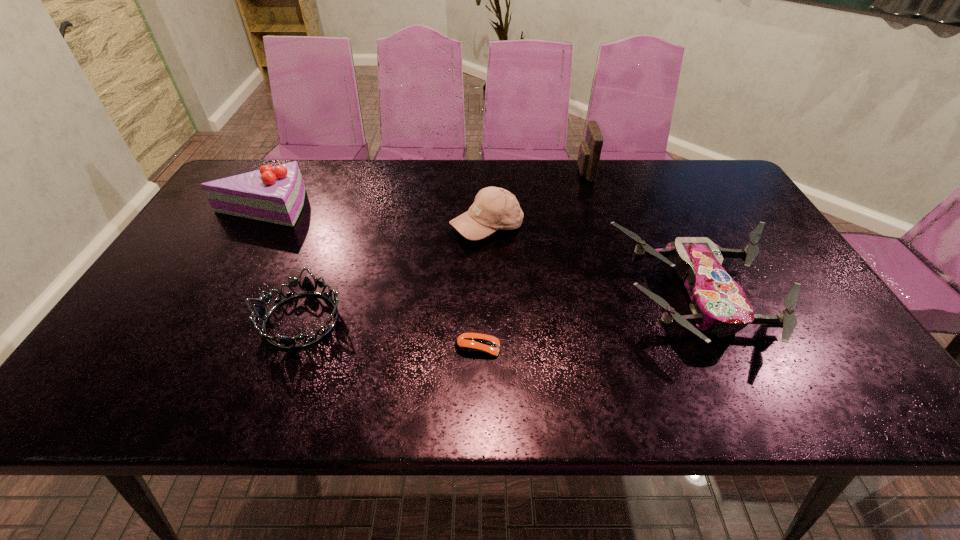
Locate an element on the screen. The image size is (960, 540). vacant area that lies between the cake and the shortest object is located at coordinates (370, 277).

This screenshot has width=960, height=540. What are the coordinates of `unoccupied position between the second shortest object and the shortest object` in the screenshot? It's located at (390, 334).

This screenshot has width=960, height=540. I want to click on free space between the pouch and the cake, so click(x=422, y=190).

Identify the location of object that is the third closest to the cake. The image size is (960, 540). (472, 344).

At what (x,y) coordinates should I click in order to perform the action: click on object that is the closest to the leftmost object. Please return your answer as a coordinate pair (x, y). Looking at the image, I should click on (307, 287).

Find the location of a particular element. The image size is (960, 540). free location that satisfies the following two spatial constraints: 1. with an open flap on the pouch; 2. on the front-facing side of the tiara is located at coordinates (630, 320).

You are a GUI agent. You are given a task and a screenshot of the screen. Output one action in this format:
    pyautogui.click(x=<x>, y=<y>)
    Task: Click on the free region that satisfies the following two spatial constraints: 1. with an open flap on the pouch; 2. on the front-facing side of the baseball cap
    
    Given the screenshot: What is the action you would take?
    601,227